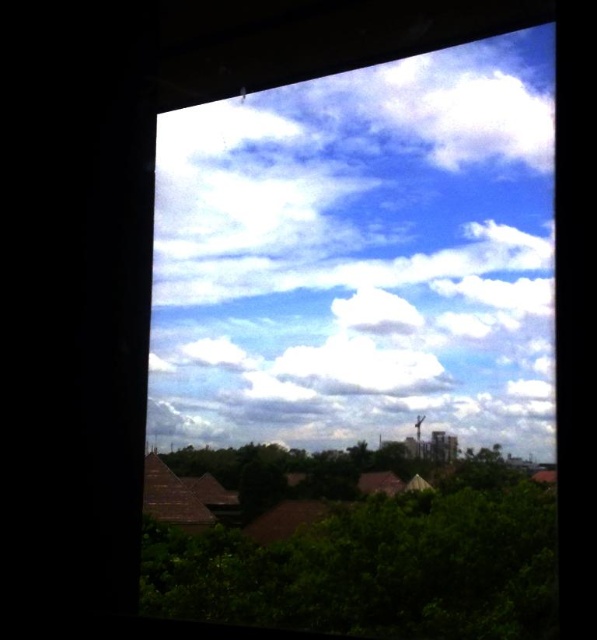
You are an architect designing a new building and want to ensure that the rooftop will not block the view of the white fluffy cloud at upper center from the ground floor windows. Given that the green leafy tree at lower left is currently blocking part of the view, can you determine if the cloud will still be visible once the tree is trimmed?

The white fluffy cloud at upper center has a smaller width than the green leafy tree at lower left. Since the tree is blocking part of the view, trimming it may allow the narrower cloud to become visible again.

You are standing in a room and looking through the window. There is a point marked at coordinates (x=361, y=257). What object in the scene corresponds to this point?

The point at coordinates (x=361, y=257) corresponds to the white fluffy cloud at upper center.